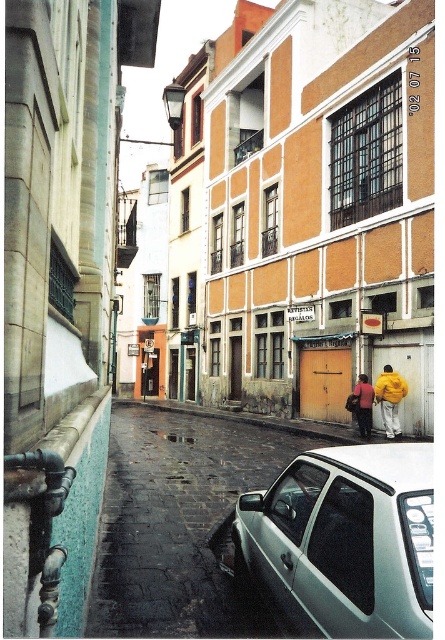
Question: Which point is closer to the camera?

Choices:
 (A) tap(238, 500)
 (B) tap(391, 436)

Answer: (A)

Question: Where is white glossy car at lower right located in relation to yellow fabric jacket at lower right in the image?

Choices:
 (A) below
 (B) above

Answer: (A)

Question: Estimate the real-world distances between objects in this image. Which object is closer to the white matte car at lower right?

Choices:
 (A) yellow fabric jacket at lower right
 (B) white glossy car at lower right
 (C) yellow matte jacket at lower right

Answer: (B)

Question: Which is farther from the white matte car at lower right?

Choices:
 (A) yellow fabric jacket at lower right
 (B) white glossy car at lower right

Answer: (A)

Question: Is yellow matte jacket at lower right positioned before yellow fabric jacket at lower right?

Choices:
 (A) yes
 (B) no

Answer: (A)

Question: In this image, where is white matte car at lower right located relative to yellow fabric jacket at lower right?

Choices:
 (A) right
 (B) left

Answer: (B)